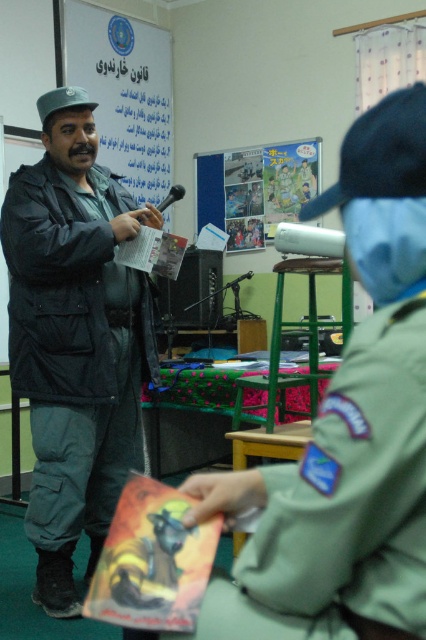
Based on the photo, based on the scene described, can you determine the position of the dark green uniform at center relative to the white matte poster at upper center?

The dark green uniform at center is to the right of the white matte poster at upper center.